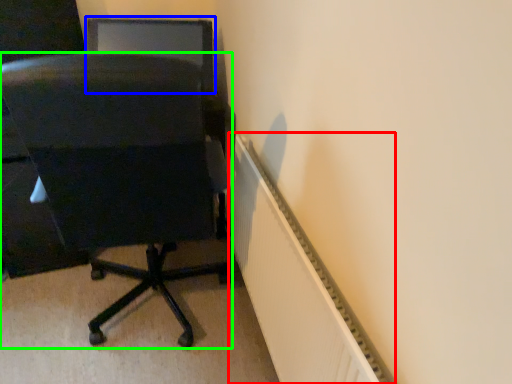
Question: Considering the real-world distances, which object is farthest from radiator (highlighted by a red box)? computer monitor (highlighted by a blue box) or chair (highlighted by a green box)?

Choices:
 (A) computer monitor
 (B) chair

Answer: (A)